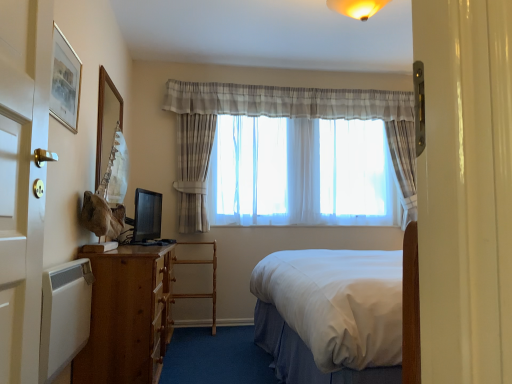
Question: From a real-world perspective, is white matte radiator at lower left located beneath wooden ladder at center?

Choices:
 (A) no
 (B) yes

Answer: (A)

Question: From a real-world perspective, is white matte radiator at lower left physically above wooden ladder at center?

Choices:
 (A) no
 (B) yes

Answer: (B)

Question: Is white matte radiator at lower left behind wooden ladder at center?

Choices:
 (A) yes
 (B) no

Answer: (B)

Question: Is wooden ladder at center at the back of white matte radiator at lower left?

Choices:
 (A) yes
 (B) no

Answer: (B)

Question: Is white matte radiator at lower left thinner than wooden ladder at center?

Choices:
 (A) no
 (B) yes

Answer: (B)

Question: Is white matte radiator at lower left shorter than wooden ladder at center?

Choices:
 (A) no
 (B) yes

Answer: (B)

Question: From the image's perspective, is wooden picture frame at upper left, arranged as the 1th picture frame when viewed from the left, above matte black monitor at left?

Choices:
 (A) no
 (B) yes

Answer: (B)

Question: Does wooden picture frame at upper left, arranged as the 1th picture frame when viewed from the left, have a greater width compared to matte black monitor at left?

Choices:
 (A) no
 (B) yes

Answer: (A)

Question: From a real-world perspective, is wooden picture frame at upper left, arranged as the 2th picture frame when viewed from the right, located higher than matte black monitor at left?

Choices:
 (A) no
 (B) yes

Answer: (B)

Question: From the image's perspective, is wooden picture frame at upper left, arranged as the 1th picture frame when viewed from the left, located beneath matte black monitor at left?

Choices:
 (A) no
 (B) yes

Answer: (A)

Question: Is the surface of wooden picture frame at upper left, arranged as the 2th picture frame when viewed from the right, in direct contact with matte black monitor at left?

Choices:
 (A) no
 (B) yes

Answer: (A)

Question: Can you confirm if wooden picture frame at upper left, arranged as the 1th picture frame when viewed from the left, is shorter than matte black monitor at left?

Choices:
 (A) no
 (B) yes

Answer: (A)

Question: From a real-world perspective, is wooden picture frame at upper left, acting as the first picture frame starting from the back, on top of translucent fabric curtain at center?

Choices:
 (A) yes
 (B) no

Answer: (B)